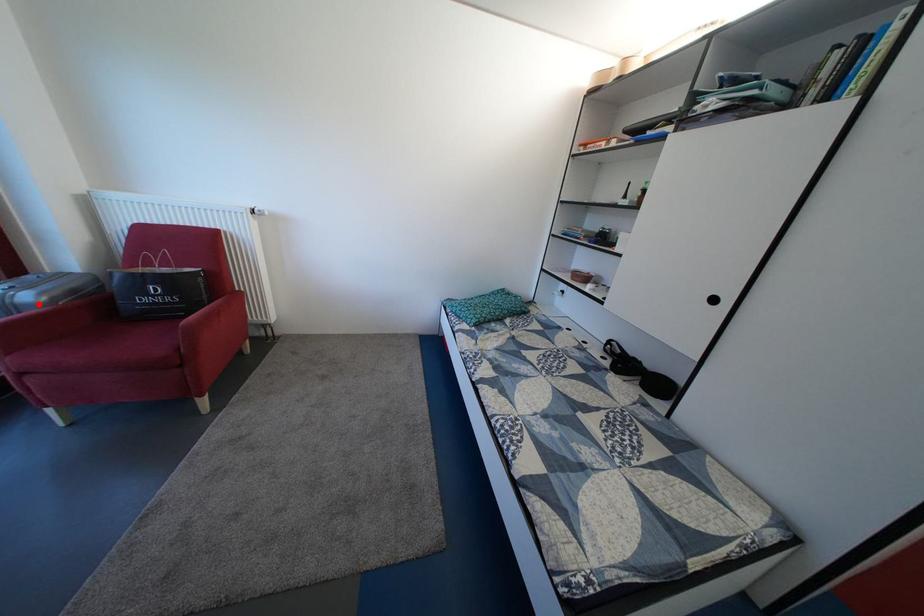
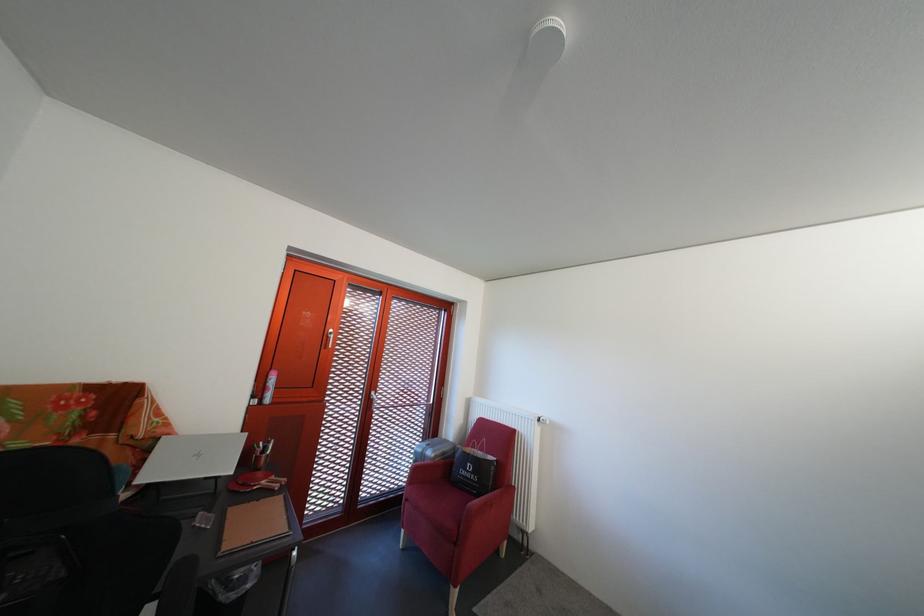
In the second image, find the point that corresponds to the highlighted location in the first image.

(441, 459)